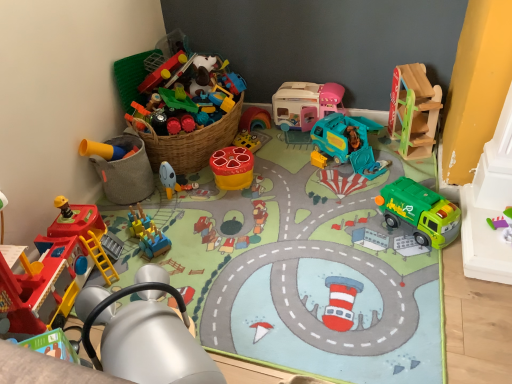
The height and width of the screenshot is (384, 512). I want to click on free space in front of green plastic garbage truck at lower right, which is the 8th toy in left-to-right order, so click(416, 266).